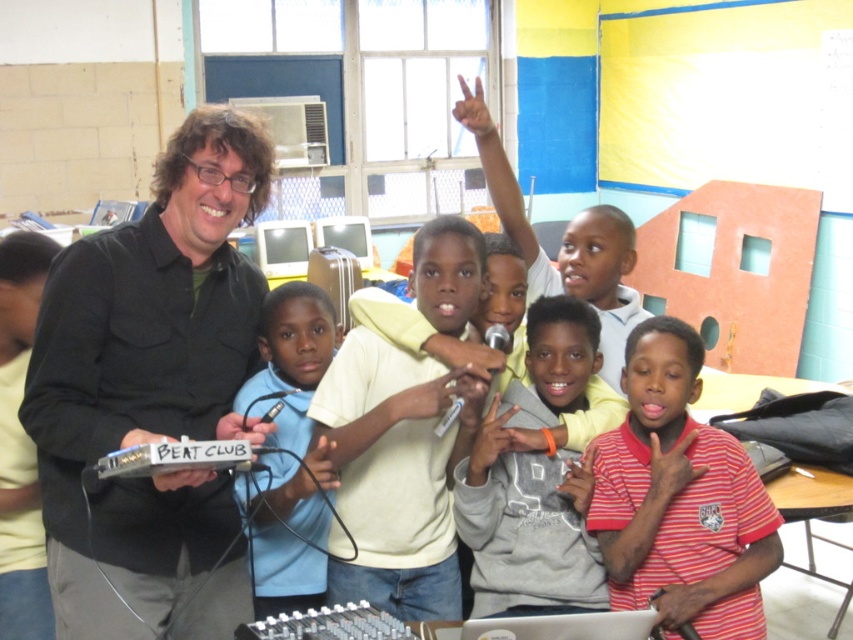
You are a photographer in the classroom and want to take a picture of both the black matte shirt at center and the blue fabric shirt at center. Which shirt should you focus on first if you want to capture them from left to right in the frame?

The black matte shirt at center should be focused on first since it is positioned on the left side of the blue fabric shirt at center, so from left to right in the frame, it comes first.

You are a photographer standing at the camera position. You want to take a closeup shot of the black matte shirt at center. What is the minimum distance you need to move forward to ensure the shirt fills the frame?

The black matte shirt at center is 1.56 meters away from the camera. To take a closeup shot, you need to move forward until you are within 1 meter of the shirt, so you must move at least 0.56 meters closer.